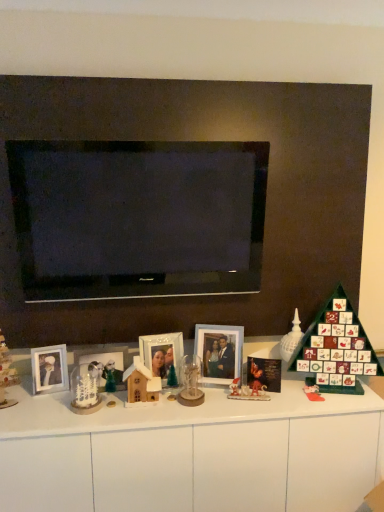
This screenshot has height=512, width=384. In order to click on vacant area situated to the left side of clear glass candle holder at center, which is the 1th candle holder in right-to-left order in this screenshot , I will do `click(152, 409)`.